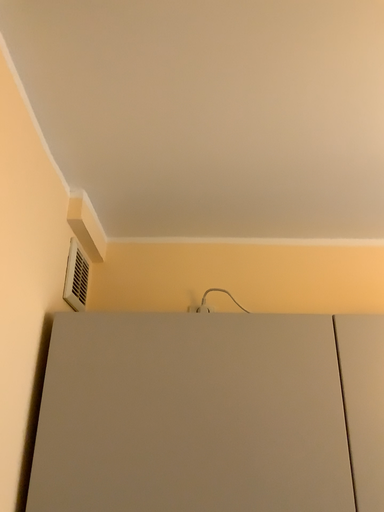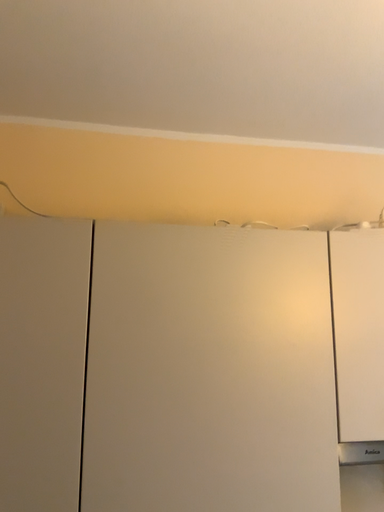
Question: How did the camera likely rotate when shooting the video?

Choices:
 (A) rotated right
 (B) rotated left

Answer: (A)